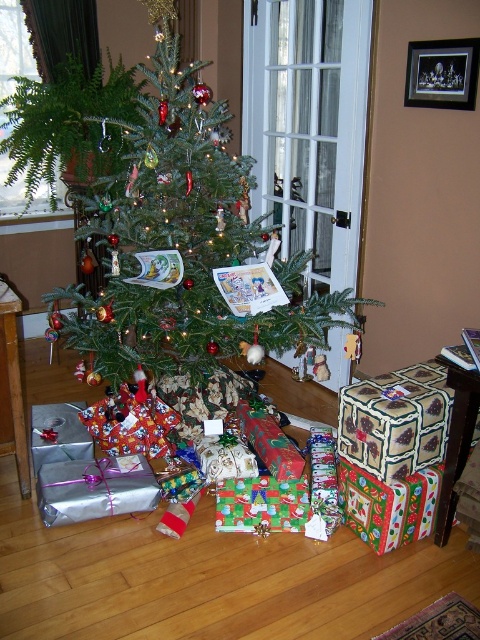
Question: Which point is closer to the camera taking this photo?

Choices:
 (A) (39, 129)
 (B) (133, 179)

Answer: (B)

Question: Is green matte christmas tree at center above green leafy plant at upper left?

Choices:
 (A) yes
 (B) no

Answer: (B)

Question: Can you confirm if green matte christmas tree at center is positioned to the left of green leafy plant at upper left?

Choices:
 (A) no
 (B) yes

Answer: (A)

Question: Which point is closer to the camera?

Choices:
 (A) (50, 145)
 (B) (191, 65)

Answer: (B)

Question: Is green matte christmas tree at center behind green leafy plant at upper left?

Choices:
 (A) yes
 (B) no

Answer: (B)